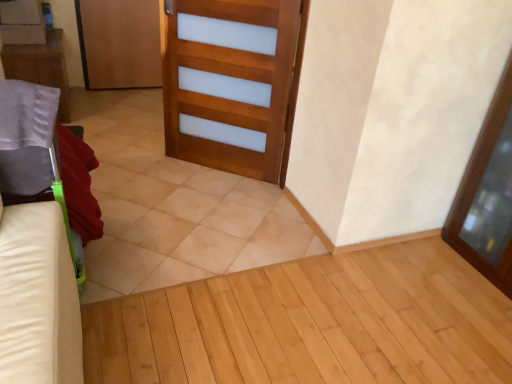
Measure the distance between point (281, 145) and camera.

Point (281, 145) and camera are 2.62 meters apart from each other.

The width and height of the screenshot is (512, 384). What are the coordinates of `matte gray pillow at left` in the screenshot? It's located at (40, 67).

Is matte gray pillow at left to the left or to the right of wooden door at upper left, acting as the second door starting from the front, in the image?

Based on their positions, matte gray pillow at left is located to the left of wooden door at upper left, acting as the second door starting from the front.

From a real-world perspective, is matte gray pillow at left on wooden door at upper left, which ranks as the 2th door in bottom-to-top order?

No, from a real-world perspective, matte gray pillow at left is not on top of wooden door at upper left, which ranks as the 2th door in bottom-to-top order.

Can you tell me how much matte gray pillow at left and wooden door at upper left, which is counted as the first door, starting from the back, differ in facing direction?

There is a 90-degree angle between the facing directions of matte gray pillow at left and wooden door at upper left, which is counted as the first door, starting from the back.

What's the angular difference between matte gray pillow at left and beige tile at center's facing directions?

The angle between the facing direction of matte gray pillow at left and the facing direction of beige tile at center is 87.5 degrees.

Is matte gray pillow at left spatially inside beige tile at center, or outside of it?

matte gray pillow at left is not enclosed by beige tile at center.

Are matte gray pillow at left and beige tile at center beside each other?

No, matte gray pillow at left is not next to beige tile at center.

Which of these two, wooden door at upper left, which is the second door from right to left, or matte gray pillow at left, is wider?

matte gray pillow at left is wider.

The image size is (512, 384). I want to click on door that appears behind the matte gray pillow at left, so click(119, 43).

Is wooden door at upper left, acting as the second door starting from the front, not inside matte gray pillow at left?

wooden door at upper left, acting as the second door starting from the front, is positioned outside matte gray pillow at left.

Is wooden door at upper left, which ranks as the 2th door in bottom-to-top order, not near matte gray pillow at left?

Actually, wooden door at upper left, which ranks as the 2th door in bottom-to-top order, and matte gray pillow at left are a little close together.

Which object is positioned more to the left, matte gray pillow at left or wooden door at center, the 2th door positioned from the back?

Positioned to the left is matte gray pillow at left.

What's the angular difference between matte gray pillow at left and wooden door at center, arranged as the second door when viewed from the top,'s facing directions?

116 degrees separate the facing orientations of matte gray pillow at left and wooden door at center, arranged as the second door when viewed from the top.

Is the depth of matte gray pillow at left greater than that of wooden door at center, which ranks as the first door in front-to-back order?

That is True.

Is point (23, 48) positioned after point (248, 108)?

Yes, point (23, 48) is farther from viewer.

Can you confirm if matte gray pillow at left is taller than transparent glass screen door at right?

In fact, matte gray pillow at left may be shorter than transparent glass screen door at right.

Is matte gray pillow at left looking in the opposite direction of transparent glass screen door at right?

No, matte gray pillow at left's orientation is not away from transparent glass screen door at right.

Looking at the image, does matte gray pillow at left seem bigger or smaller compared to transparent glass screen door at right?

Clearly, matte gray pillow at left is smaller in size than transparent glass screen door at right.

Is point (202, 80) closer or farther from the camera than point (213, 175)?

Point (202, 80) is positioned closer to the camera compared to point (213, 175).

Which object is wider, wooden door at center, which ranks as the first door in front-to-back order, or beige tile at center?

Result: beige tile at center.

At what (x,y) coordinates should I click in order to perform the action: click on the 1st door behind the beige tile at center, counting from the anchor's position. Please return your answer as a coordinate pair (x, y). This screenshot has width=512, height=384. Looking at the image, I should click on (232, 80).

Considering the sizes of objects wooden door at center, the 2th door positioned from the back, and beige tile at center in the image provided, who is taller, wooden door at center, the 2th door positioned from the back, or beige tile at center?

Standing taller between the two is wooden door at center, the 2th door positioned from the back.

Which point is more distant from viewer, (150, 64) or (482, 254)?

Positioned behind is point (150, 64).

Consider the image. Which of these two, wooden door at upper left, which is counted as the 1th door, starting from the top, or transparent glass screen door at right, is bigger?

With larger size is transparent glass screen door at right.

What's the angular difference between wooden door at upper left, acting as the second door starting from the front, and transparent glass screen door at right's facing directions?

The angular difference between wooden door at upper left, acting as the second door starting from the front, and transparent glass screen door at right is 90 degrees.

From the matte gray pillow at left, count 1st door to the right and point to it. Please provide its 2D coordinates.

[(119, 43)]

In order to click on tile that is in front of the matte gray pillow at left in this screenshot , I will do `click(173, 206)`.

Looking at the image, which one is located closer to beige tile at center, matte gray pillow at left or wooden door at center, the 2th door positioned from the back?

wooden door at center, the 2th door positioned from the back.

Based on their spatial positions, is matte gray pillow at left or beige tile at center closer to wooden door at center, the first door when ordered from bottom to top?

beige tile at center.

Estimate the real-world distances between objects in this image. Which object is closer to wooden door at center, the second door when ordered from left to right, wooden door at upper left, the first door from the left, or transparent glass screen door at right?

The object closer to wooden door at center, the second door when ordered from left to right, is transparent glass screen door at right.

Looking at this image, estimate the real-world distances between objects in this image. Which object is further from transparent glass screen door at right, beige tile at center or wooden door at upper left, which ranks as the 2th door in bottom-to-top order?

The object further to transparent glass screen door at right is wooden door at upper left, which ranks as the 2th door in bottom-to-top order.

Looking at the image, which one is located further to matte gray pillow at left, wooden door at upper left, the first door from the left, or wooden door at center, acting as the first door starting from the right?

Based on the image, wooden door at center, acting as the first door starting from the right, appears to be further to matte gray pillow at left.

From the picture: When comparing their distances from matte gray pillow at left, does wooden door at center, acting as the first door starting from the right, or wooden door at upper left, which is the second door from right to left, seem further?

wooden door at center, acting as the first door starting from the right.

Considering their positions, is transparent glass screen door at right positioned further to wooden door at upper left, which is counted as the first door, starting from the back, than matte gray pillow at left?

transparent glass screen door at right is further to wooden door at upper left, which is counted as the first door, starting from the back.

When comparing their distances from wooden door at center, arranged as the second door when viewed from the top, does matte gray pillow at left or transparent glass screen door at right seem further?

transparent glass screen door at right.

Where is `tile between matte gray pillow at left and transparent glass screen door at right`? Image resolution: width=512 pixels, height=384 pixels. tile between matte gray pillow at left and transparent glass screen door at right is located at coordinates (173, 206).

Locate an element on the screen. door between matte gray pillow at left and wooden door at center, the second door when ordered from left to right, in the horizontal direction is located at coordinates (119, 43).

This screenshot has width=512, height=384. I want to click on door between wooden door at upper left, the first door from the left, and transparent glass screen door at right from left to right, so click(x=232, y=80).

The height and width of the screenshot is (384, 512). Find the location of `furniture located between beige tile at center and wooden door at upper left, which is counted as the first door, starting from the back, in the depth direction`. furniture located between beige tile at center and wooden door at upper left, which is counted as the first door, starting from the back, in the depth direction is located at coordinates (40, 67).